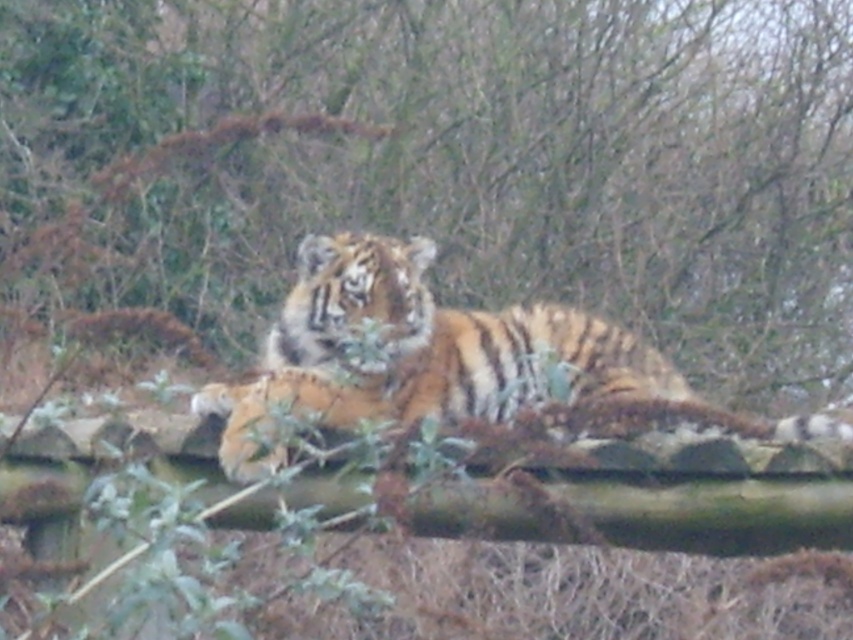
Is brown textured log at center behind orange striped tiger at center?

That is True.

Is brown textured log at center wider than orange striped tiger at center?

Yes.

Which is behind, point (90, 179) or point (210, 404)?

Point (90, 179)

Where is `brown textured log at center`? The width and height of the screenshot is (853, 640). brown textured log at center is located at coordinates (450, 163).